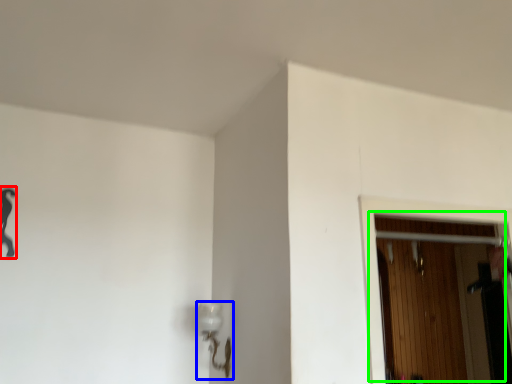
Question: Based on their relative distances, which object is nearer to woman (highlighted by a red box)? Choose from lamp (highlighted by a blue box) and door (highlighted by a green box).

Choices:
 (A) lamp
 (B) door

Answer: (A)